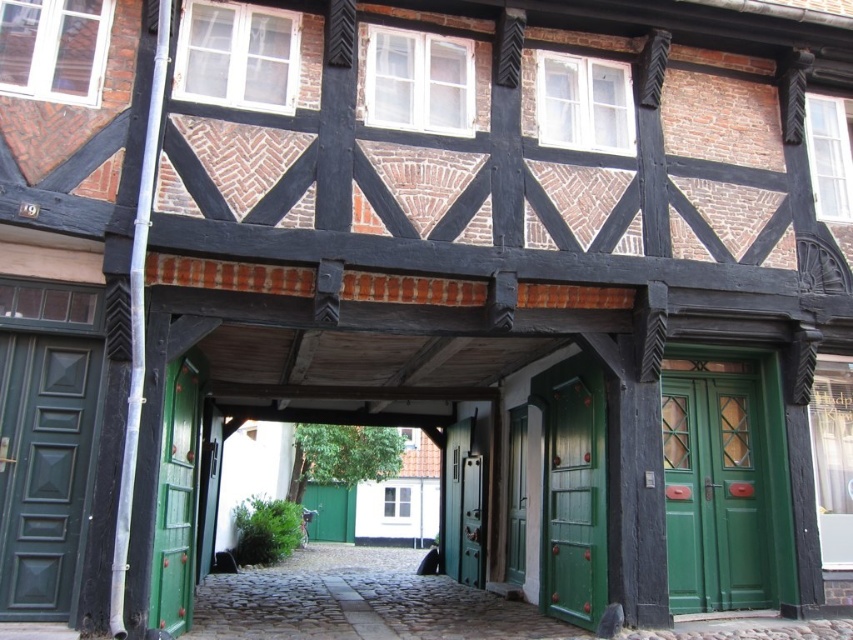
Question: Which object is closer to the camera taking this photo?

Choices:
 (A) green glossy door at center
 (B) green matte door at center
 (C) green wooden door at center

Answer: (C)

Question: Does green wooden door at left appear on the right side of metallic silver door at center?

Choices:
 (A) yes
 (B) no

Answer: (B)

Question: Which point is closer to the camera?

Choices:
 (A) (90, 340)
 (B) (509, 474)
 (C) (473, 536)
 (D) (180, 627)

Answer: (A)

Question: Based on their relative distances, which object is farther from the green wooden door at left?

Choices:
 (A) metallic silver door at center
 (B) green wooden door at center

Answer: (A)

Question: Is green matte door at center closer to the viewer compared to metallic silver door at center?

Choices:
 (A) yes
 (B) no

Answer: (A)

Question: Can you confirm if green wooden door at center is positioned to the left of green matte door at center?

Choices:
 (A) no
 (B) yes

Answer: (A)